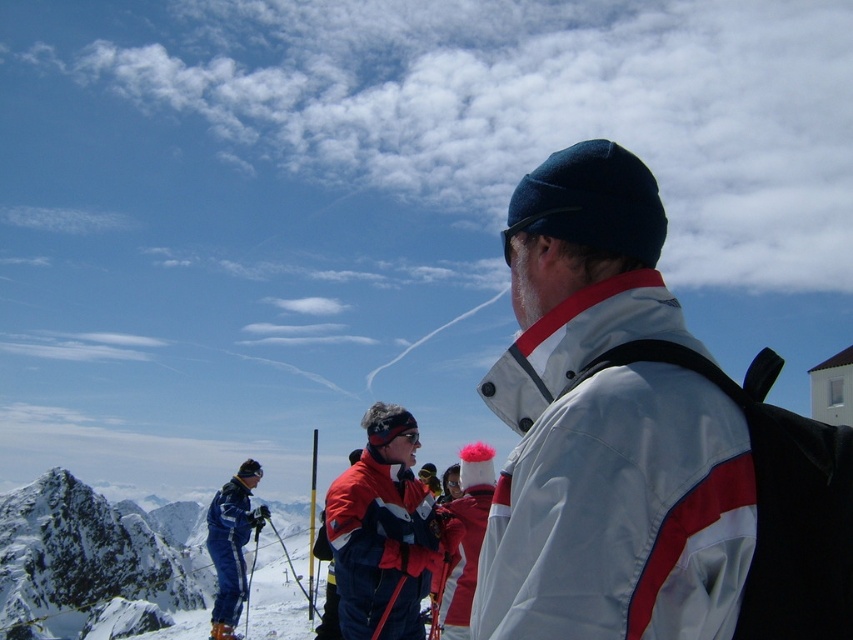
Question: From the image, what is the correct spatial relationship of snowy peak at left in relation to red fabric jacket at center?

Choices:
 (A) left
 (B) right

Answer: (A)

Question: Which point is closer to the camera?

Choices:
 (A) snowy peak at left
 (B) red fabric jacket at center
 (C) blue ski suit at left
 (D) white matte jacket at center

Answer: (D)

Question: Which point appears closest to the camera in this image?

Choices:
 (A) (575, 320)
 (B) (259, 634)

Answer: (A)

Question: Can you confirm if white matte jacket at center is smaller than blue ski suit at left?

Choices:
 (A) yes
 (B) no

Answer: (A)

Question: Is snowy peak at left bigger than red fabric jacket at center?

Choices:
 (A) yes
 (B) no

Answer: (A)

Question: Among these points, which one is farthest from the camera?

Choices:
 (A) (357, 468)
 (B) (44, 515)

Answer: (B)